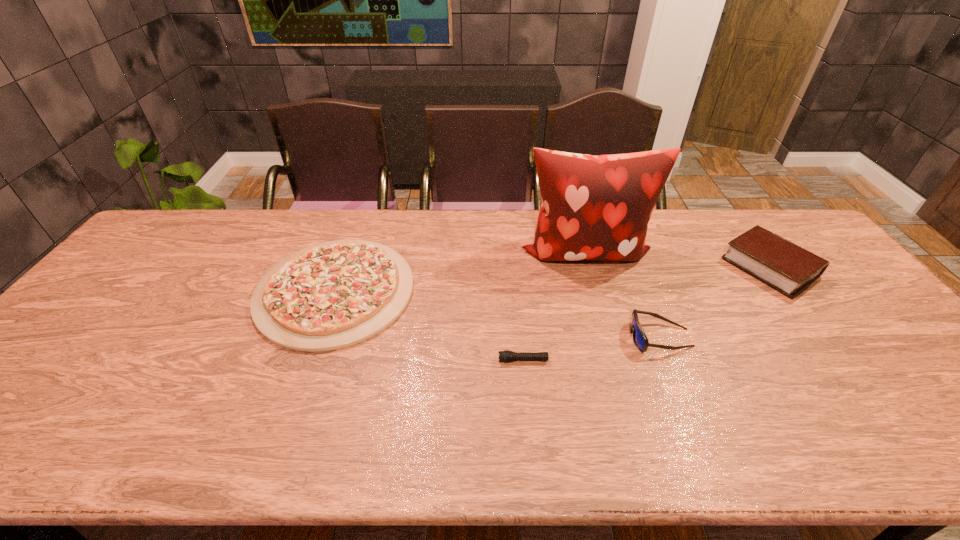
This screenshot has height=540, width=960. Identify the location of the tallest object. (598, 207).

In order to click on the rightmost object in this screenshot , I will do `click(790, 269)`.

Locate an element on the screen. This screenshot has width=960, height=540. sunglasses is located at coordinates (640, 339).

Locate an element on the screen. The width and height of the screenshot is (960, 540). the leftmost object is located at coordinates coord(329,296).

Where is `pizza`? The height and width of the screenshot is (540, 960). pizza is located at coordinates (329, 296).

Find the location of a particular element. This screenshot has height=540, width=960. the shortest object is located at coordinates (507, 356).

Image resolution: width=960 pixels, height=540 pixels. Identify the location of free space located 0.310m on the front-facing side of the tallest object. (615, 361).

You are a GUI agent. You are given a task and a screenshot of the screen. Output one action in this format:
    pyautogui.click(x=<x>, y=<y>)
    Task: Click on the vacant region located on the front of the Bible
    Image resolution: width=960 pixels, height=540 pixels.
    Given the screenshot: What is the action you would take?
    pyautogui.click(x=891, y=429)

The height and width of the screenshot is (540, 960). Identify the location of vacant area situated 0.080m on the front-facing side of the sunglasses. (598, 338).

Where is `free spot located on the front-facing side of the sunglasses`? free spot located on the front-facing side of the sunglasses is located at coordinates (489, 338).